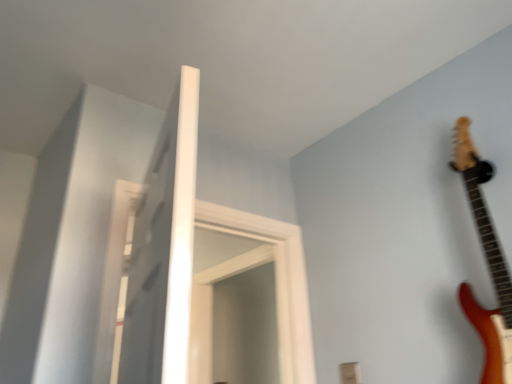
Image resolution: width=512 pixels, height=384 pixels. Describe the element at coordinates (487, 263) in the screenshot. I see `glossy wood guitar at right` at that location.

Locate an element on the screen. glossy wood guitar at right is located at coordinates (487, 263).

Where is `glossy wood guitar at right`? glossy wood guitar at right is located at coordinates (487, 263).